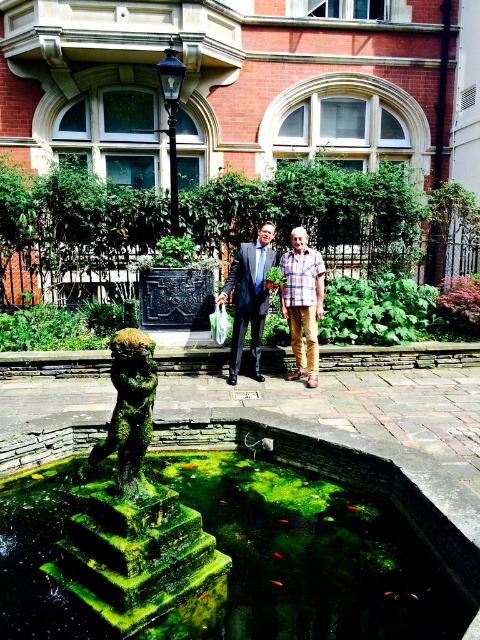
Question: Which point is farther to the camera?

Choices:
 (A) (280, 586)
 (B) (291, 625)
 (C) (266, 266)
 (D) (276, 556)

Answer: (C)

Question: Which of the following is the closest to the observer?

Choices:
 (A) pyautogui.click(x=294, y=291)
 (B) pyautogui.click(x=171, y=42)

Answer: (A)

Question: Among these objects, which one is nearest to the camera?

Choices:
 (A) orange translucent fish at center
 (B) plaid fabric shirt at center
 (C) plaid shirt at center
 (D) green mossy stone at center

Answer: (D)

Question: Does black metal lamp post at upper center have a lesser width compared to orange translucent fish at center?

Choices:
 (A) yes
 (B) no

Answer: (B)

Question: Can you confirm if green mossy stone at center is positioned to the right of orange translucent fish at center?

Choices:
 (A) yes
 (B) no

Answer: (A)

Question: Does black metal lamp post at upper center have a lesser width compared to orange shiny fish at center?

Choices:
 (A) no
 (B) yes

Answer: (A)